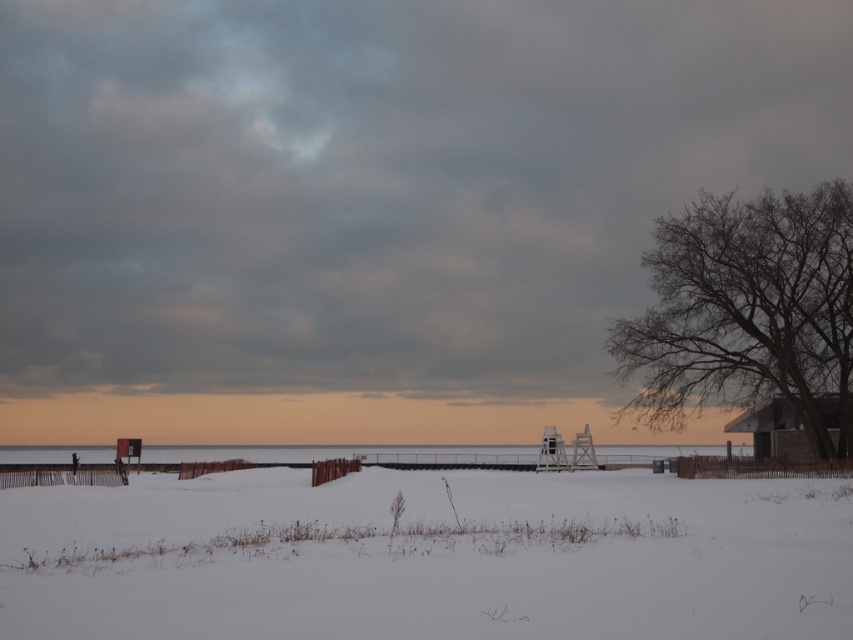
Between white fluffy snow at center and clear water at center, which one is positioned lower?

Positioned lower is clear water at center.

Which is in front, point (514, 621) or point (601, 454)?

Point (514, 621) is in front.

Locate an element on the screen. This screenshot has height=640, width=853. white fluffy snow at center is located at coordinates (428, 556).

Who is positioned more to the left, bare branches at right or clear water at center?

From the viewer's perspective, clear water at center appears more on the left side.

Is bare branches at right below clear water at center?

No, bare branches at right is not below clear water at center.

Find the location of a particular element. bare branches at right is located at coordinates (747, 310).

Is bare branches at right further to the viewer compared to wooden cabin at right?

Yes.

Which is above, bare branches at right or wooden cabin at right?

Positioned higher is bare branches at right.

The width and height of the screenshot is (853, 640). I want to click on bare branches at right, so click(x=747, y=310).